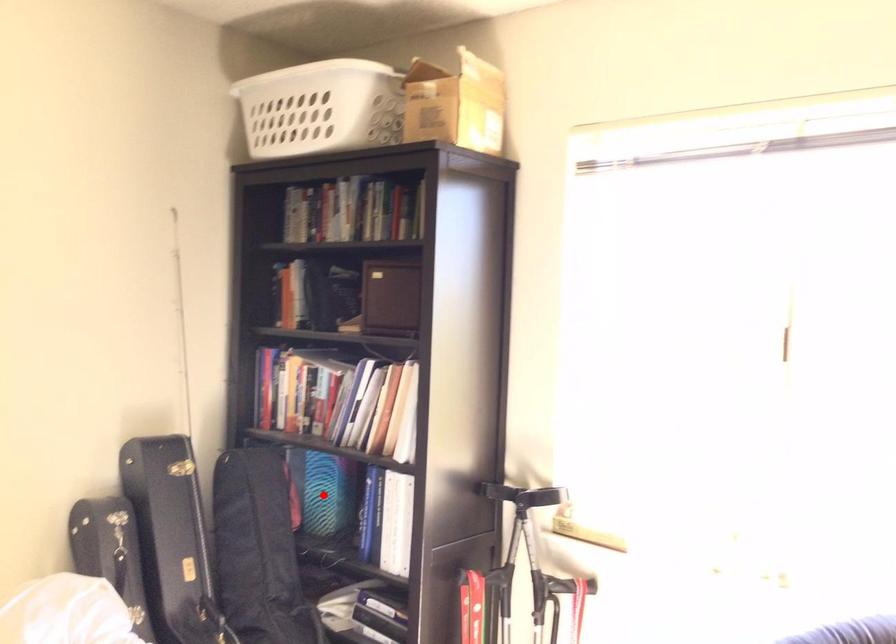
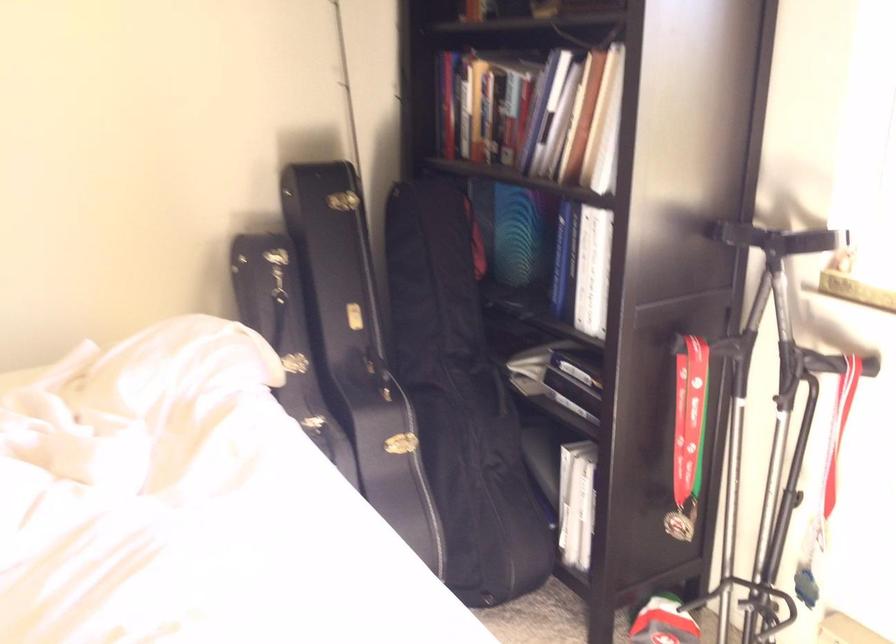
The point at the highlighted location is marked in the first image. Where is the corresponding point in the second image?

(519, 236)